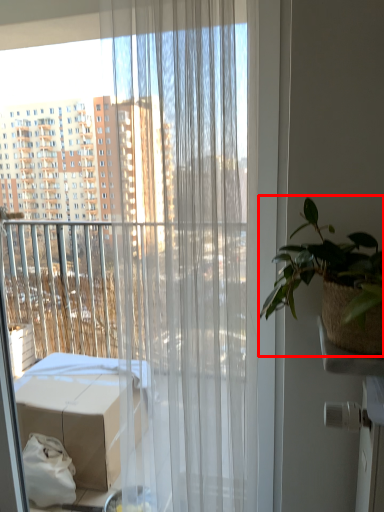
Question: From the image, what is the correct spatial relationship of houseplant (annotated by the red box) in relation to curtain?

Choices:
 (A) left
 (B) right

Answer: (B)